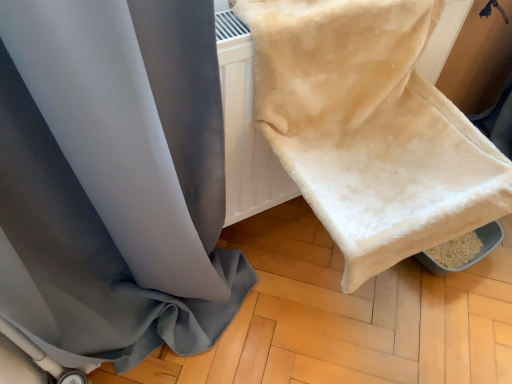
Question: Is beige plush towel at upper right to the left or to the right of satin gray curtain at upper left in the image?

Choices:
 (A) left
 (B) right

Answer: (B)

Question: Looking at the image, does beige plush towel at upper right seem bigger or smaller compared to satin gray curtain at upper left?

Choices:
 (A) big
 (B) small

Answer: (B)

Question: Considering the positions of beige plush towel at upper right and satin gray curtain at upper left in the image, is beige plush towel at upper right taller or shorter than satin gray curtain at upper left?

Choices:
 (A) tall
 (B) short

Answer: (B)

Question: Considering the positions of satin gray curtain at upper left and beige plush towel at upper right in the image, is satin gray curtain at upper left wider or thinner than beige plush towel at upper right?

Choices:
 (A) wide
 (B) thin

Answer: (B)

Question: From a real-world perspective, is satin gray curtain at upper left physically located above or below beige plush towel at upper right?

Choices:
 (A) above
 (B) below

Answer: (B)

Question: Would you say satin gray curtain at upper left is to the left or to the right of beige plush towel at upper right in the picture?

Choices:
 (A) left
 (B) right

Answer: (A)

Question: From the image's perspective, is satin gray curtain at upper left positioned above or below beige plush towel at upper right?

Choices:
 (A) above
 (B) below

Answer: (B)